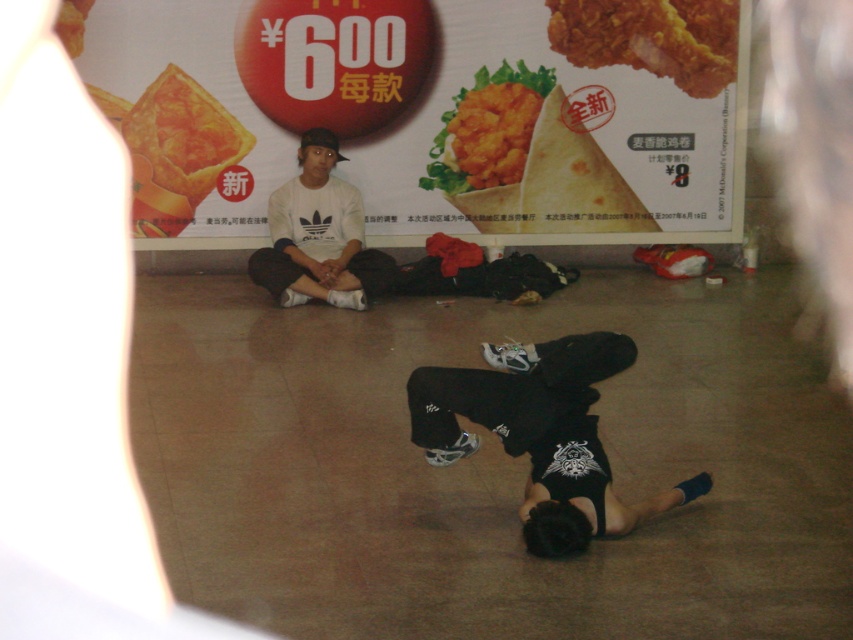
Question: Can you confirm if black matte/soft squat at lower center is thinner than white matte shirt at center?

Choices:
 (A) yes
 (B) no

Answer: (B)

Question: Is the position of white matte shirt at center more distant than that of golden crispy chicken at center?

Choices:
 (A) yes
 (B) no

Answer: (B)

Question: Which object appears farthest from the camera in this image?

Choices:
 (A) black matte/soft squat at lower center
 (B) golden crispy chicken at upper right

Answer: (B)

Question: Among these objects, which one is farthest from the camera?

Choices:
 (A) white matte shirt at center
 (B) golden crispy chicken at upper right

Answer: (B)

Question: Which of the following is the farthest from the observer?

Choices:
 (A) (521, 93)
 (B) (575, 358)

Answer: (A)

Question: Considering the relative positions of white matte shirt at center and golden crispy chicken at upper right in the image provided, where is white matte shirt at center located with respect to golden crispy chicken at upper right?

Choices:
 (A) right
 (B) left

Answer: (B)